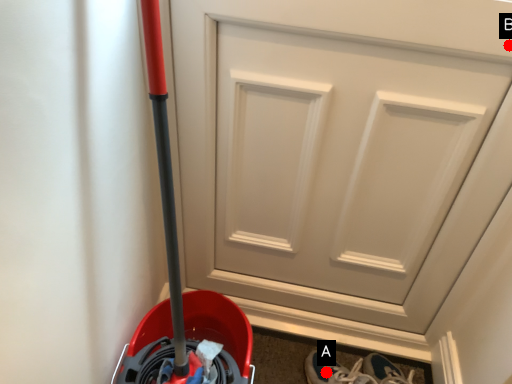
Question: Two points are circled on the image, labeled by A and B beside each circle. Which point is closer to the camera taking this photo?

Choices:
 (A) A is closer
 (B) B is closer

Answer: (B)